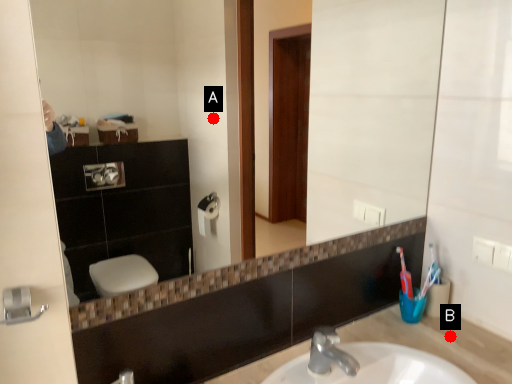
Question: Two points are circled on the image, labeled by A and B beside each circle. Among these points, which one is farthest from the camera?

Choices:
 (A) A is further
 (B) B is further

Answer: (B)